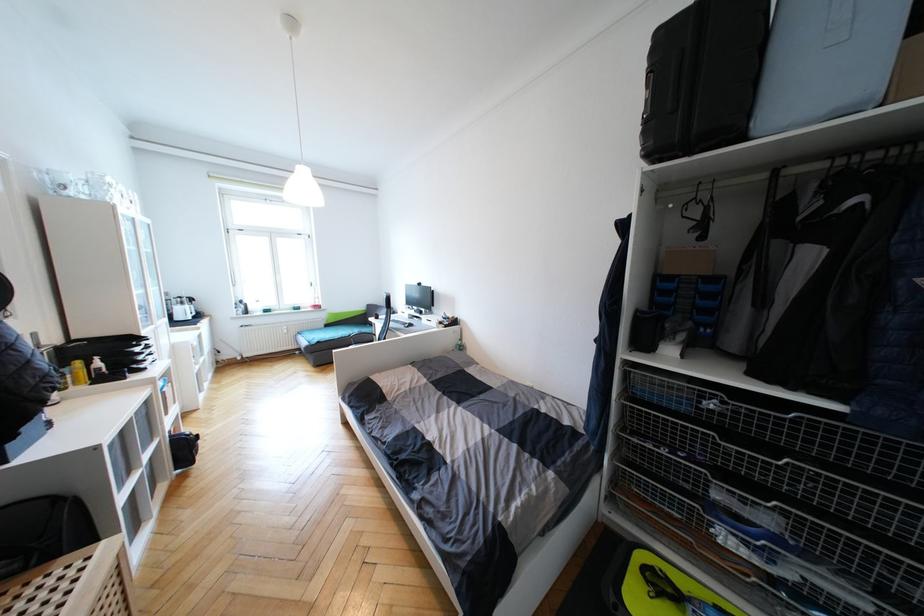
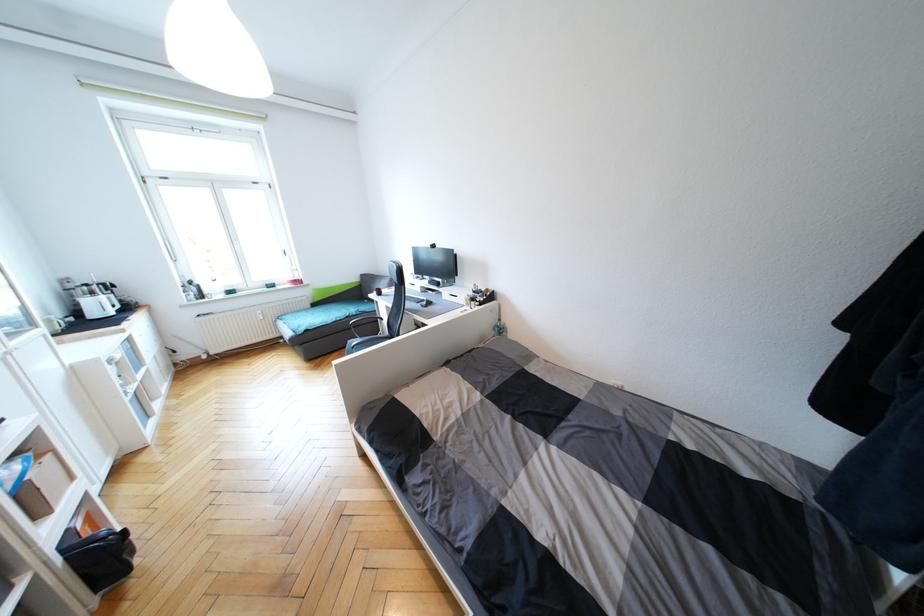
In the second image, find the point that corresponds to (186,305) in the first image.

(95, 294)